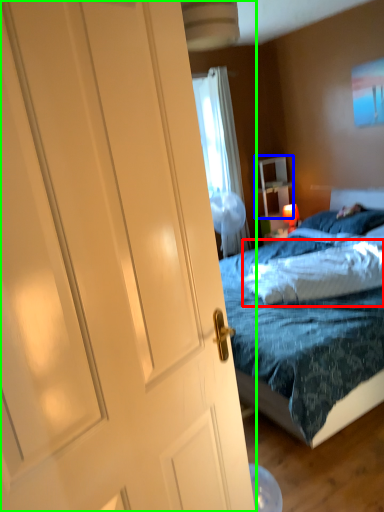
Question: Which object is positioned farthest from pillow (highlighted by a red box)? Select from nightstand (highlighted by a blue box) and door (highlighted by a green box).

Choices:
 (A) nightstand
 (B) door

Answer: (A)